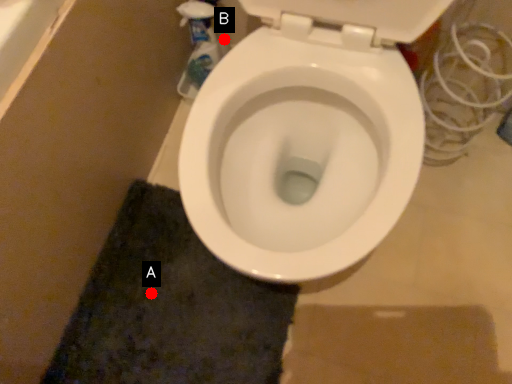
Question: Two points are circled on the image, labeled by A and B beside each circle. Which point is farther from the camera taking this photo?

Choices:
 (A) A is further
 (B) B is further

Answer: (B)